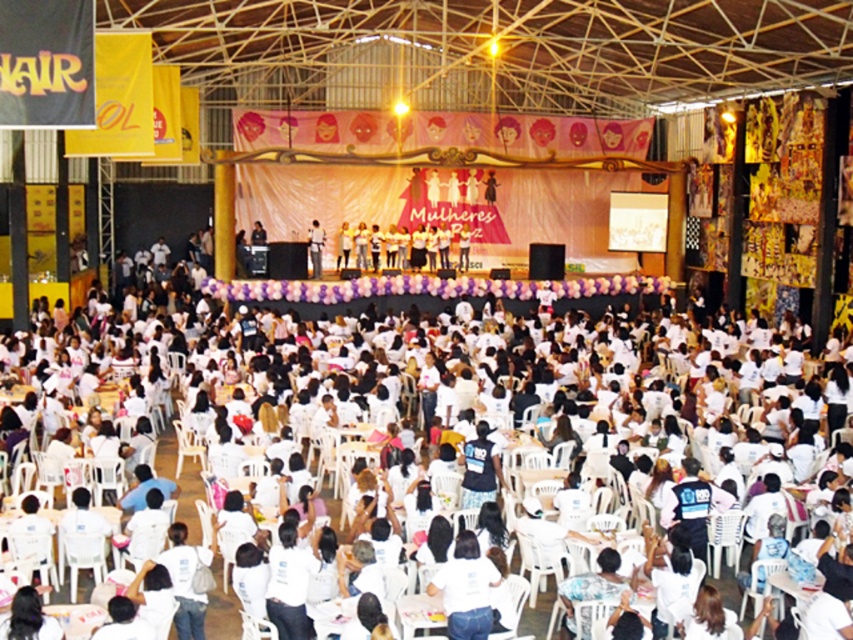
Can you confirm if white matte shirt at lower center is wider than matte black shirt at center?

Indeed, white matte shirt at lower center has a greater width compared to matte black shirt at center.

Does white matte shirt at lower center have a larger size compared to matte black shirt at center?

Correct, white matte shirt at lower center is larger in size than matte black shirt at center.

Does point (479, 566) come closer to viewer compared to point (312, 225)?

Yes, point (479, 566) is closer to viewer.

Where is `white matte shirt at lower center`? The height and width of the screenshot is (640, 853). white matte shirt at lower center is located at coordinates (466, 589).